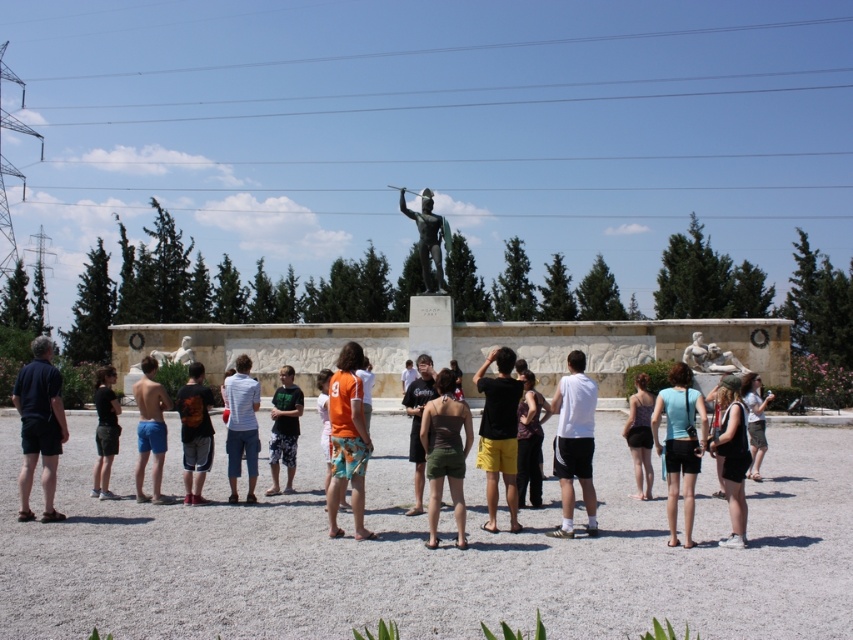
Question: Can you confirm if blue fabric shorts at center is smaller than blue shorts at center?

Choices:
 (A) yes
 (B) no

Answer: (A)

Question: Where is dark blue shirt at left located in relation to blue fabric shorts at center in the image?

Choices:
 (A) above
 (B) below

Answer: (B)

Question: Among these points, which one is farthest from the camera?

Choices:
 (A) (448, 433)
 (B) (274, 416)
 (C) (735, 467)

Answer: (B)

Question: Among these points, which one is farthest from the camera?

Choices:
 (A) (722, 474)
 (B) (753, 376)
 (C) (537, 497)
 (D) (410, 404)

Answer: (B)

Question: Among these objects, which one is farthest from the camera?

Choices:
 (A) blue fabric shorts at center
 (B) matte black tank top at center
 (C) dark orange t-shirt at center

Answer: (B)

Question: Can you confirm if white cotton shirt at center is positioned above dark orange t-shirt at center?

Choices:
 (A) yes
 (B) no

Answer: (A)